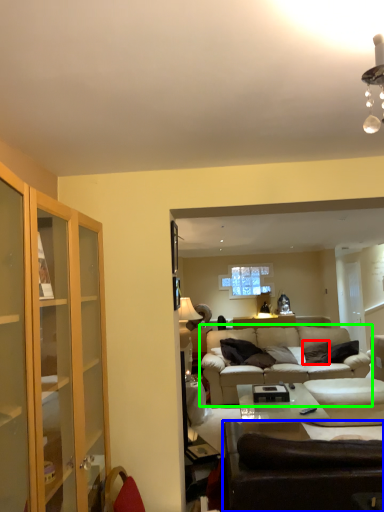
Question: Based on their relative distances, which object is nearer to pillow (highlighted by a red box)? Choose from studio couch (highlighted by a blue box) and studio couch (highlighted by a green box).

Choices:
 (A) studio couch
 (B) studio couch

Answer: (B)